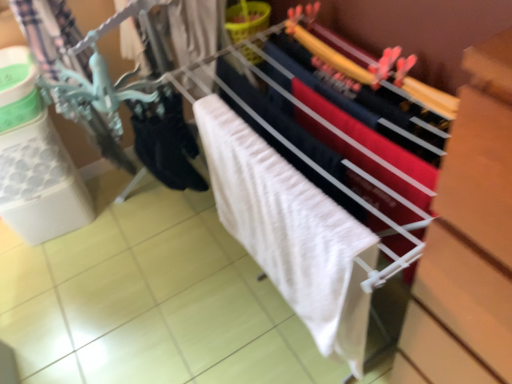
Question: Is white textured bath towel at center behind black matte socks at lower left?

Choices:
 (A) no
 (B) yes

Answer: (A)

Question: Does white textured bath towel at center have a smaller size compared to black matte socks at lower left?

Choices:
 (A) no
 (B) yes

Answer: (A)

Question: From a real-world perspective, is white textured bath towel at center located higher than black matte socks at lower left?

Choices:
 (A) no
 (B) yes

Answer: (A)

Question: Considering the relative sizes of white textured bath towel at center and black matte socks at lower left in the image provided, is white textured bath towel at center wider than black matte socks at lower left?

Choices:
 (A) no
 (B) yes

Answer: (B)

Question: Would you say white textured bath towel at center is outside black matte socks at lower left?

Choices:
 (A) no
 (B) yes

Answer: (B)

Question: Can you confirm if white textured bath towel at center is thinner than black matte socks at lower left?

Choices:
 (A) no
 (B) yes

Answer: (A)

Question: Is white fabric at center at the back of white textured bath towel at center?

Choices:
 (A) no
 (B) yes

Answer: (B)

Question: Is white textured bath towel at center at the right side of white fabric at center?

Choices:
 (A) yes
 (B) no

Answer: (B)

Question: Is white textured bath towel at center not within white fabric at center?

Choices:
 (A) yes
 (B) no

Answer: (B)

Question: Is white textured bath towel at center placed right next to white fabric at center?

Choices:
 (A) no
 (B) yes

Answer: (A)

Question: Considering the relative positions of white textured bath towel at center and white fabric at center in the image provided, is white textured bath towel at center to the left of white fabric at center from the viewer's perspective?

Choices:
 (A) no
 (B) yes

Answer: (B)

Question: Is white textured bath towel at center wider than white fabric at center?

Choices:
 (A) yes
 (B) no

Answer: (B)

Question: Does white fabric at center have a lesser width compared to white textured bath towel at center?

Choices:
 (A) no
 (B) yes

Answer: (A)